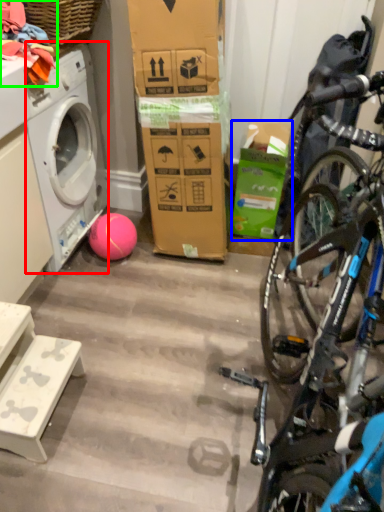
Question: Which object is positioned farthest from washing machine (highlighted by a red box)? Select from box (highlighted by a blue box) and clothing (highlighted by a green box).

Choices:
 (A) box
 (B) clothing

Answer: (A)